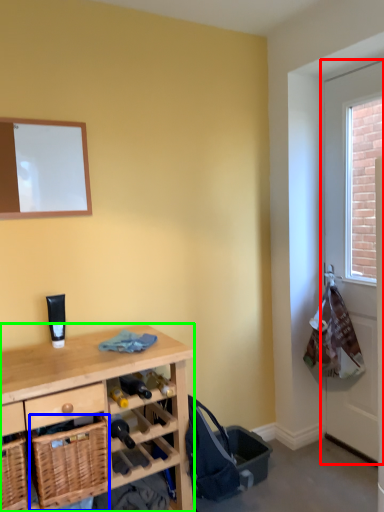
Question: Which object is the farthest from screen door (highlighted by a red box)? Choose among these: basket (highlighted by a blue box) or desk (highlighted by a green box).

Choices:
 (A) basket
 (B) desk

Answer: (A)